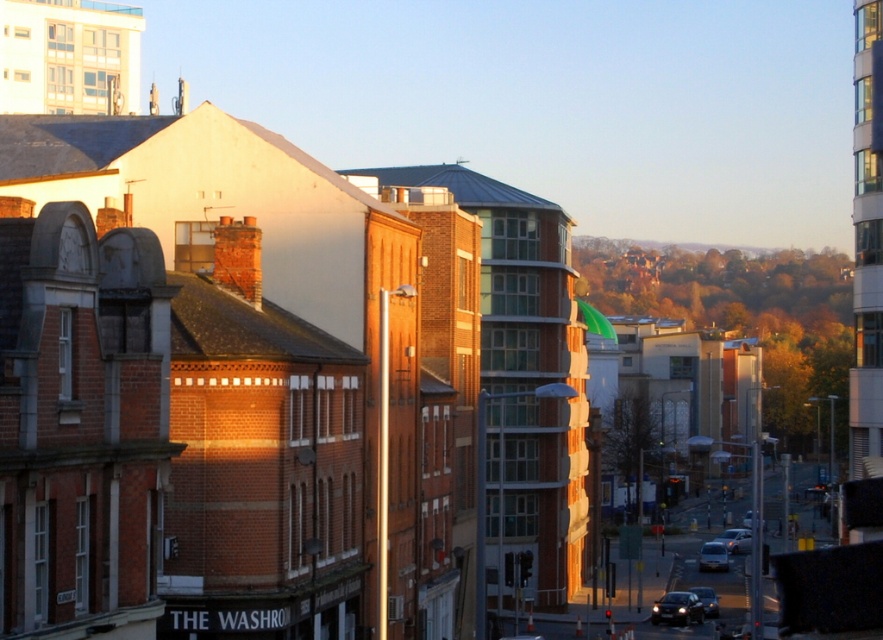
You are a delivery driver trying to park your vehicle in a narrow alley between the shiny black car at lower right and the shiny silver sedan at center. The alley is only 2 meters wide. Can your 1.8 meter wide van fit between them without touching either vehicle?

The alley is 2 meters wide, and your van is 1.8 meters wide. Since 1.8 meters is less than 2 meters, your van can fit between the shiny black car at lower right and the shiny silver sedan at center without touching either vehicle.

You are a pedestrian standing at the center of the image. You see a shiny black car at lower right and a shiny black sedan at lower right. Which one is positioned higher in the image?

The shiny black car at lower right is positioned higher than the shiny black sedan at lower right in the image.

Based on the photo, you are a delivery person with a cart that is 1.8 meters wide. You need to navigate between the shiny black car at lower right and the shiny black sedan at lower right to reach the delivery point. Can your cart fit through the space between them?

The shiny black car at lower right and the shiny black sedan at lower right are 1.66 meters apart from each other. Since your cart is 1.8 meters wide, it cannot fit through the space between them as the gap is narrower than the cart.